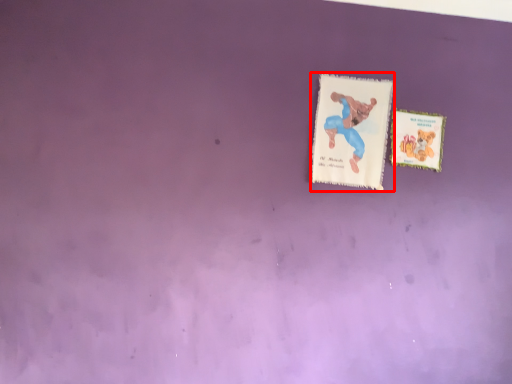
Question: From the image, what is the correct spatial relationship of card (annotated by the red box) in relation to card?

Choices:
 (A) right
 (B) left

Answer: (B)